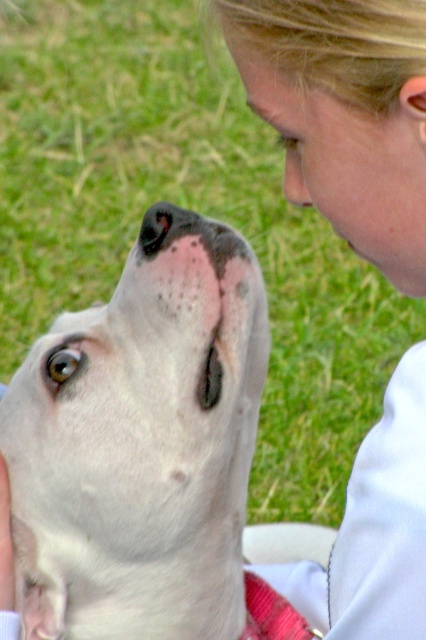
Which is behind, point (65, 531) or point (425, 378)?

The point (65, 531) is more distant.

Does white smooth dog at center have a lesser height compared to blonde hair at upper center?

Correct, white smooth dog at center is not as tall as blonde hair at upper center.

Which is behind, point (49, 588) or point (412, 13)?

Point (49, 588)

Locate an element on the screen. This screenshot has width=426, height=640. white smooth dog at center is located at coordinates (141, 444).

Can you confirm if blonde hair at upper center is thinner than pink soft tissue at upper center?

Incorrect, blonde hair at upper center's width is not less than pink soft tissue at upper center's.

Consider the image. Can you confirm if blonde hair at upper center is smaller than pink soft tissue at upper center?

Actually, blonde hair at upper center might be larger than pink soft tissue at upper center.

The height and width of the screenshot is (640, 426). Identify the location of blonde hair at upper center. (347, 113).

Is white smooth dog at center shorter than pink soft tissue at upper center?

No, white smooth dog at center is not shorter than pink soft tissue at upper center.

Is point (152, 602) closer to camera compared to point (287, 170)?

No, (152, 602) is behind (287, 170).

In order to click on white smooth dog at center in this screenshot , I will do `click(141, 444)`.